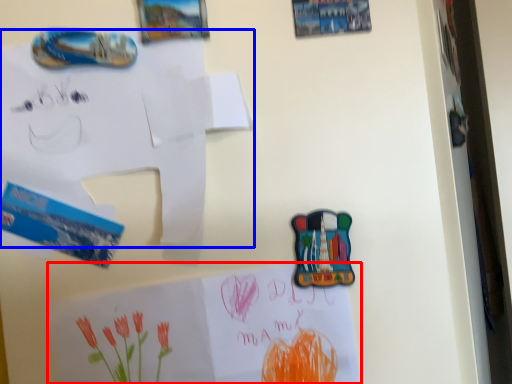
Question: Which of the following is the closest to the observer, paper (highlighted by a red box) or paper (highlighted by a blue box)?

Choices:
 (A) paper
 (B) paper

Answer: (B)